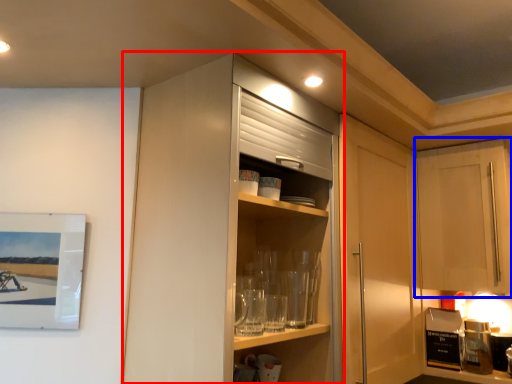
Question: Which of the following is the farthest to the observer, cabinetry (highlighted by a red box) or cabinetry (highlighted by a blue box)?

Choices:
 (A) cabinetry
 (B) cabinetry

Answer: (B)